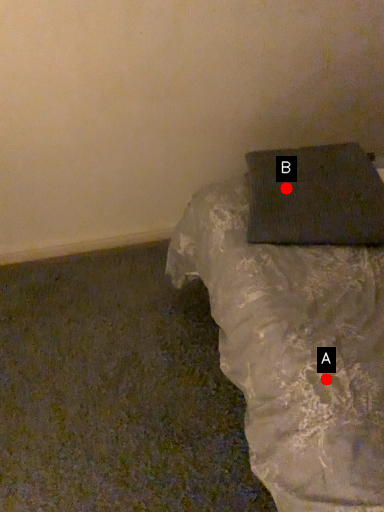
Question: Two points are circled on the image, labeled by A and B beside each circle. Which point is farther to the camera?

Choices:
 (A) A is further
 (B) B is further

Answer: (B)